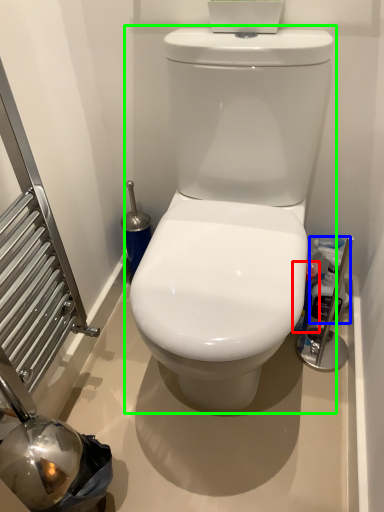
Question: Which is nearer to the cleaning product (highlighted by a red box)? cleaning product (highlighted by a blue box) or toilet (highlighted by a green box).

Choices:
 (A) cleaning product
 (B) toilet

Answer: (A)